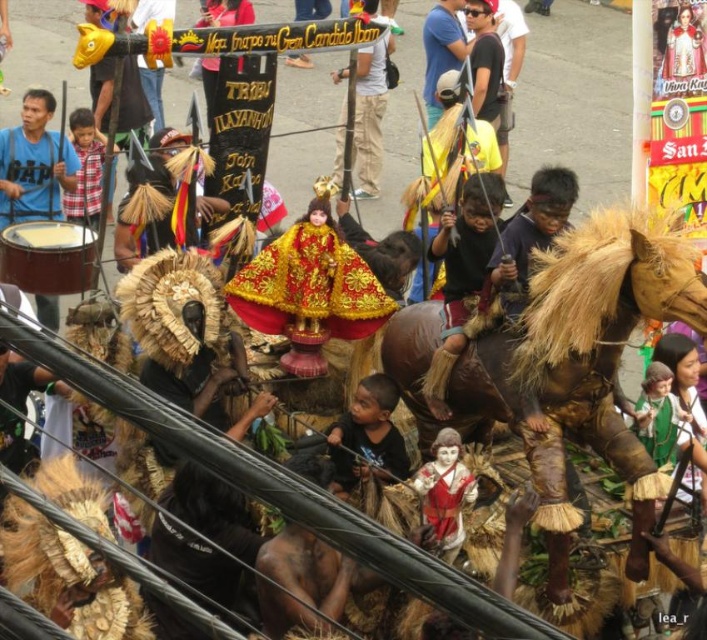
You are a photographer at the festival and want to capture both the matte gold helmet at center and the blue cotton shirt at upper center in a single frame. Given their heights, which object should you focus on to ensure both are visible without cropping?

The matte gold helmet at center is taller than the blue cotton shirt at upper center. To ensure both are visible without cropping, focus on the matte gold helmet at center as it is the taller object and adjust the frame to include its full height, which will naturally include the shorter blue cotton shirt at upper center.

Based on the photo, you are a photographer at the festival. You want to capture a photo where both the blue cotton shirt at upper center and the matte gold crown at upper center are visible. Since you can only focus on one object, which one should you choose to ensure the other is still recognizable in the frame?

The blue cotton shirt at upper center is larger in size than the matte gold crown at upper center. To ensure both are recognizable, focus on the blue cotton shirt at upper center because its larger size will remain visible even if slightly out of focus, while the smaller matte gold crown at upper center may still be discernible in the background or foreground.

You are a photographer trying to capture the cultural procession. You notice the smooth brown drum at left and the matte gold crown at upper center. Which object should you focus on to get a clearer image if you want to photograph the larger object?

The smooth brown drum at left is larger than the matte gold crown at upper center, so focusing on the smooth brown drum at left will allow you to capture the larger object more clearly.